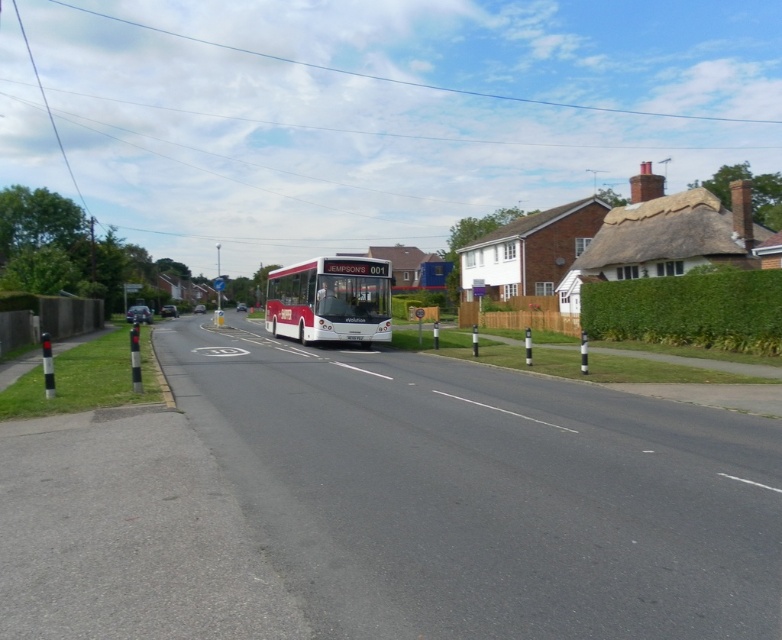
Question: Considering the relative positions of green leafy hedge at right and matte red bus at center in the image provided, where is green leafy hedge at right located with respect to matte red bus at center?

Choices:
 (A) below
 (B) above

Answer: (B)

Question: Which of the following is the closest to the observer?

Choices:
 (A) (732, 321)
 (B) (303, 285)

Answer: (A)

Question: Which point is closer to the camera?

Choices:
 (A) green leafy hedge at right
 (B) matte red bus at center

Answer: (A)

Question: Can you confirm if green leafy hedge at right is positioned below matte red bus at center?

Choices:
 (A) yes
 (B) no

Answer: (B)

Question: Does green leafy hedge at right appear over matte red bus at center?

Choices:
 (A) yes
 (B) no

Answer: (A)